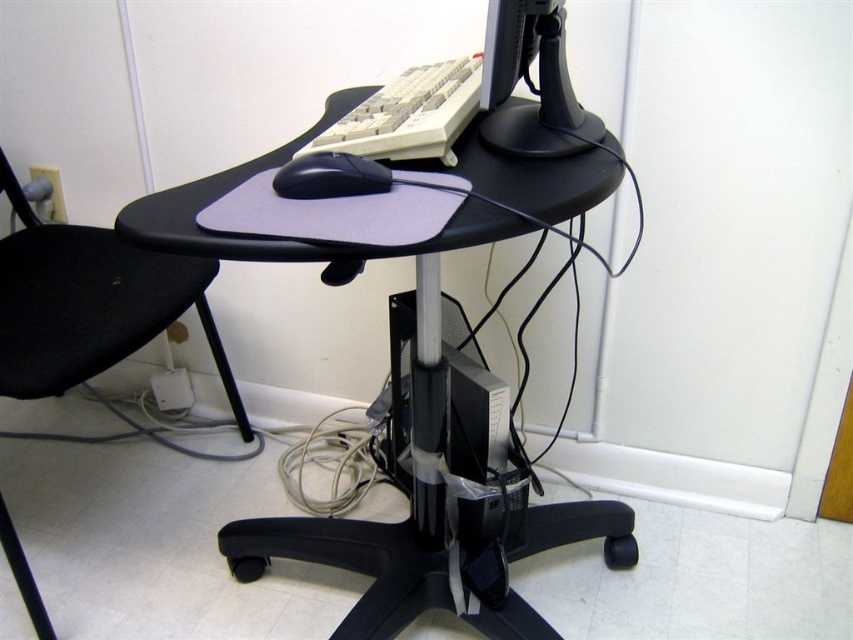
Question: Among these objects, which one is farthest from the camera?

Choices:
 (A) black matte mouse at center
 (B) matte black monitor at upper center

Answer: (A)

Question: Which object is closer to the camera taking this photo?

Choices:
 (A) black fabric chair at left
 (B) black matte mouse at center

Answer: (B)

Question: Where is black plastic computer desk at center located in relation to matte black monitor at upper center in the image?

Choices:
 (A) right
 (B) left

Answer: (B)

Question: Which of the following is the farthest from the observer?

Choices:
 (A) (519, 131)
 (B) (451, 349)

Answer: (B)

Question: Can you confirm if black plastic computer desk at center is positioned to the right of black fabric chair at left?

Choices:
 (A) yes
 (B) no

Answer: (A)

Question: Is black fabric chair at left above matte black monitor at upper center?

Choices:
 (A) no
 (B) yes

Answer: (A)